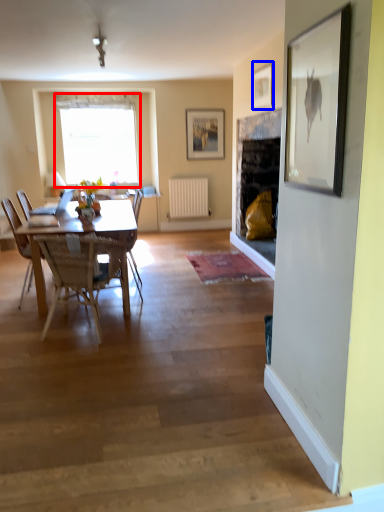
Question: Which object appears closest to the camera in this image, window (highlighted by a red box) or picture frame (highlighted by a blue box)?

Choices:
 (A) window
 (B) picture frame

Answer: (B)